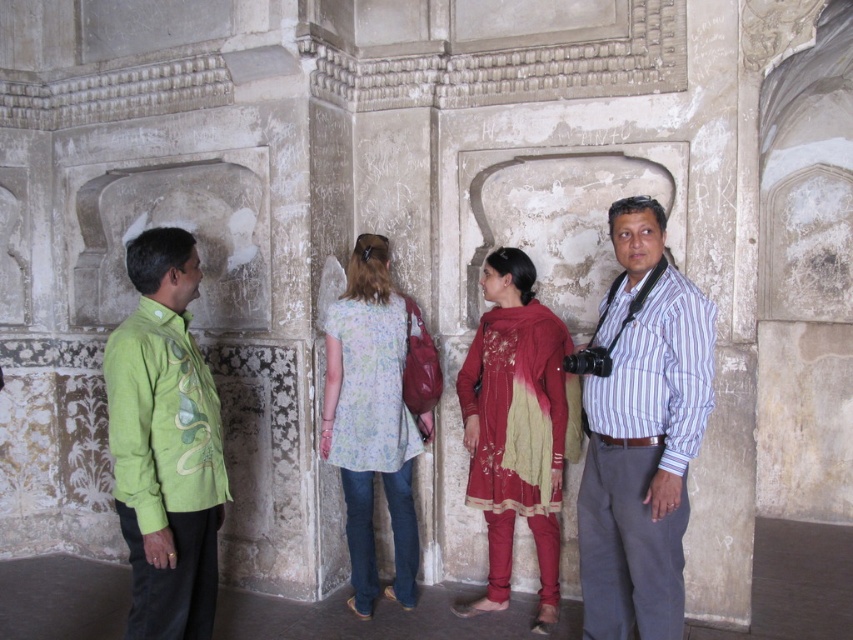
Can you confirm if striped cotton shirt at center is positioned to the right of green embroidered shirt at left?

Yes, striped cotton shirt at center is to the right of green embroidered shirt at left.

Is striped cotton shirt at center bigger than green embroidered shirt at left?

Yes, striped cotton shirt at center is bigger than green embroidered shirt at left.

Where is `striped cotton shirt at center`? This screenshot has height=640, width=853. striped cotton shirt at center is located at coordinates (641, 435).

Does maroon satin salwar kameez at center have a larger size compared to floral-patterned fabric dress at center?

Indeed, maroon satin salwar kameez at center has a larger size compared to floral-patterned fabric dress at center.

Which is behind, point (496, 284) or point (405, 413)?

Positioned behind is point (405, 413).

Locate an element on the screen. This screenshot has width=853, height=640. maroon satin salwar kameez at center is located at coordinates (515, 428).

Is green embroidered shirt at left to the left of floral-patterned fabric dress at center from the viewer's perspective?

Yes, green embroidered shirt at left is to the left of floral-patterned fabric dress at center.

Can you confirm if green embroidered shirt at left is smaller than floral-patterned fabric dress at center?

Yes, green embroidered shirt at left is smaller than floral-patterned fabric dress at center.

Is point (172, 445) farther from viewer compared to point (347, 465)?

No, it is not.

You are a GUI agent. You are given a task and a screenshot of the screen. Output one action in this format:
    pyautogui.click(x=<x>, y=<y>)
    Task: Click on the green embroidered shirt at left
    The height and width of the screenshot is (640, 853).
    Given the screenshot: What is the action you would take?
    pyautogui.click(x=165, y=444)